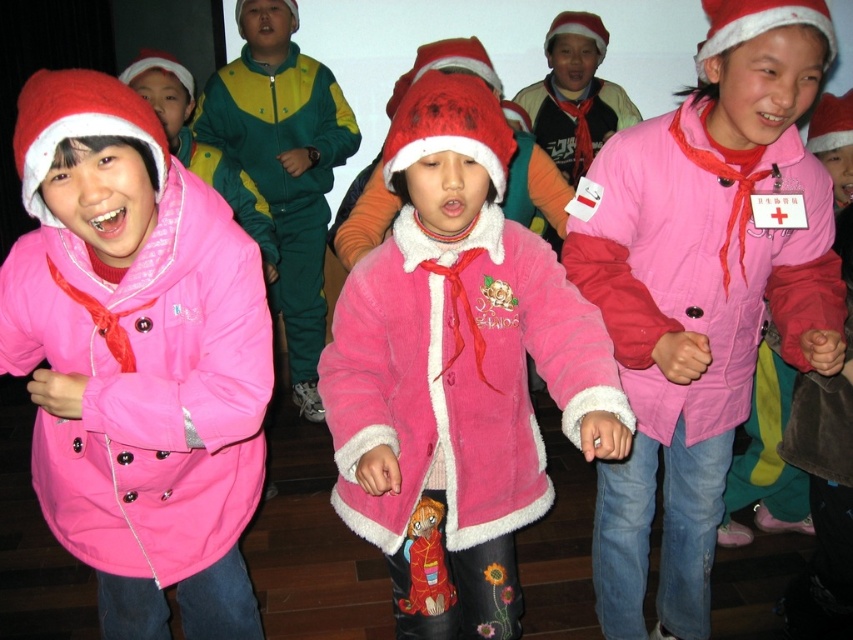
Question: Which point is farther to the camera?

Choices:
 (A) green/yellow fabric jacket at center
 (B) matte pink coat at center

Answer: (A)

Question: Can you confirm if matte pink coat at center is bigger than pink fleece jacket at center?

Choices:
 (A) yes
 (B) no

Answer: (A)

Question: In this image, where is matte pink coat at center located relative to velvet green tracksuit at center?

Choices:
 (A) below
 (B) above

Answer: (A)

Question: Which of these objects is positioned farthest from the matte pink coat at center?

Choices:
 (A) green/yellow fabric jacket at center
 (B) fuzzy pink coat at center
 (C) pink fleece jacket at center

Answer: (A)

Question: Is fuzzy pink coat at center above green/yellow fabric jacket at center?

Choices:
 (A) yes
 (B) no

Answer: (B)

Question: Which point appears farthest from the camera in this image?

Choices:
 (A) (635, 262)
 (B) (328, 116)

Answer: (B)